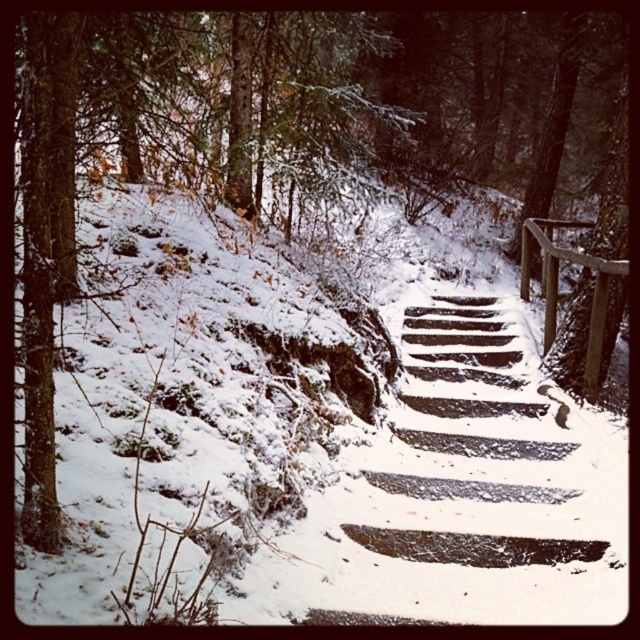
Question: Can you confirm if snow-covered wooden steps at center is positioned to the right of wooden at right?

Choices:
 (A) yes
 (B) no

Answer: (B)

Question: Which of the following is the farthest from the observer?

Choices:
 (A) (545, 237)
 (B) (468, 465)

Answer: (A)

Question: Which point appears farthest from the camera in this image?

Choices:
 (A) (524, 280)
 (B) (467, 339)

Answer: (A)

Question: Is snow-covered wooden steps at center wider than wooden at right?

Choices:
 (A) no
 (B) yes

Answer: (B)

Question: Does snow-covered wooden steps at center appear on the left side of wooden at right?

Choices:
 (A) no
 (B) yes

Answer: (B)